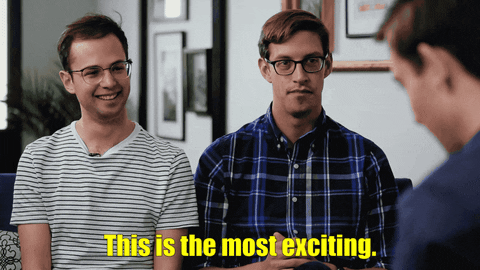
Where is `wall`? wall is located at coordinates (369, 113).